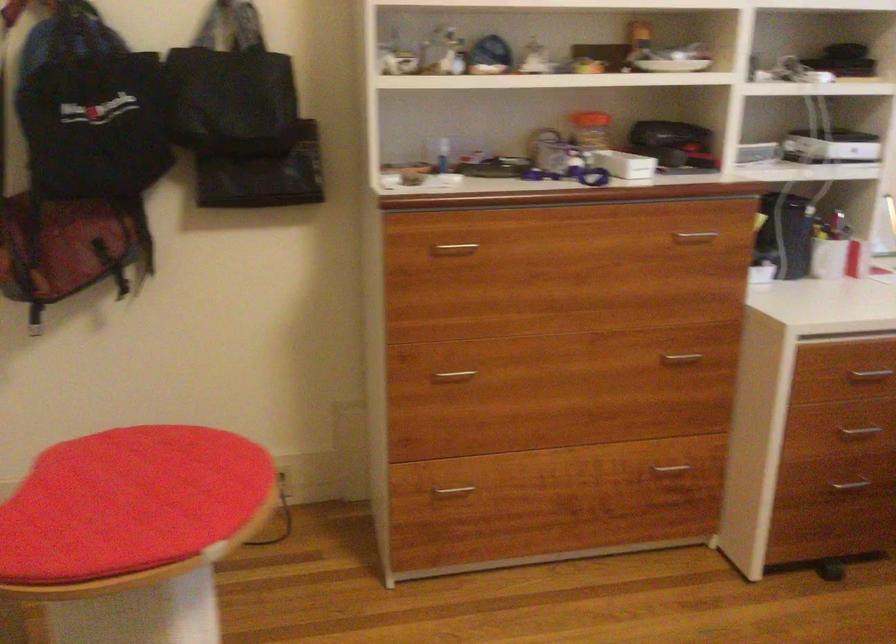
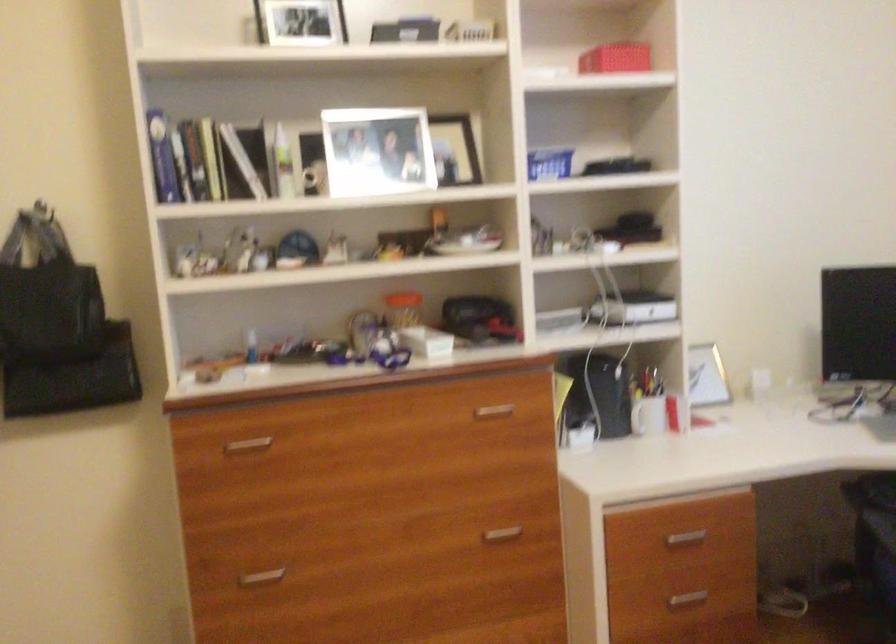
The point at (x=688, y=237) is marked in the first image. Where is the corresponding point in the second image?

(493, 412)